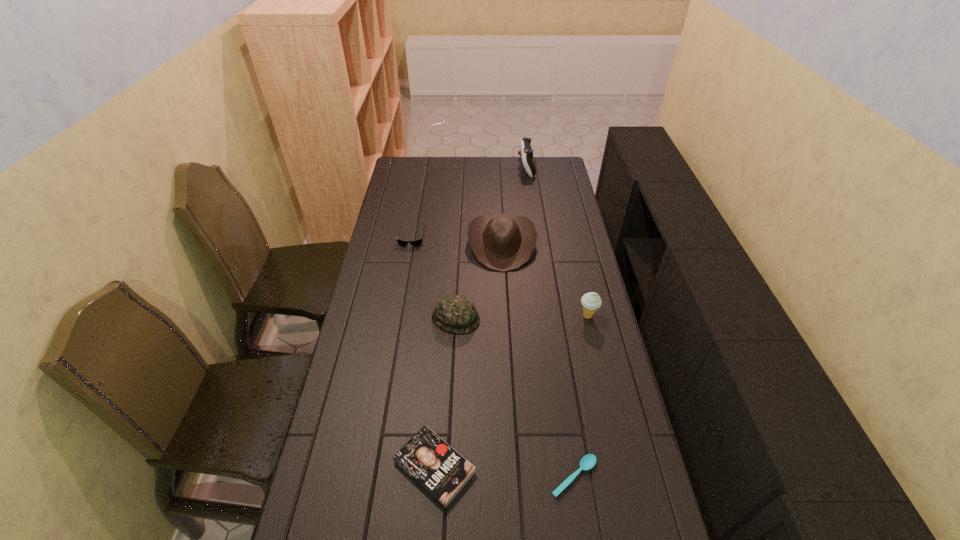
Locate an element on the screen. The width and height of the screenshot is (960, 540). free region located 0.390m on the front-facing side of the control is located at coordinates (442, 168).

At what (x,y) coordinates should I click in order to perform the action: click on free space located 0.290m on the back of the cowboy hat. Please return your answer as a coordinate pair (x, y). Image resolution: width=960 pixels, height=540 pixels. Looking at the image, I should click on (498, 184).

The height and width of the screenshot is (540, 960). I want to click on vacant space located on the left of the rightmost object, so click(x=506, y=316).

I want to click on vacant space located 0.310m on the right of the fourth shortest object, so click(x=569, y=318).

This screenshot has width=960, height=540. I want to click on vacant area situated 0.330m on the front-facing side of the fifth tallest object, so click(x=398, y=307).

You are a GUI agent. You are given a task and a screenshot of the screen. Output one action in this format:
    pyautogui.click(x=<x>, y=<y>)
    Task: Click on the vacant space situated 0.050m on the left of the book
    The height and width of the screenshot is (540, 960).
    Given the screenshot: What is the action you would take?
    pyautogui.click(x=374, y=467)

At what (x,y) coordinates should I click in order to perform the action: click on free space located 0.250m on the back of the spoon. Please return your answer as a coordinate pair (x, y). Looking at the image, I should click on (559, 376).

This screenshot has width=960, height=540. What are the coordinates of `object that is at the far edge` in the screenshot? It's located at (526, 152).

Where is `object located in the left edge section of the desktop`? object located in the left edge section of the desktop is located at coordinates (416, 242).

Where is `control positioned at the right edge`? The width and height of the screenshot is (960, 540). control positioned at the right edge is located at coordinates (526, 152).